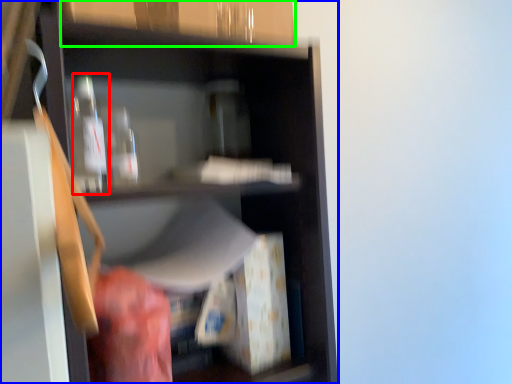
Question: Which object is the closest to the bottle (highlighted by a red box)? Choose among these: shelf (highlighted by a blue box) or cabinetry (highlighted by a green box).

Choices:
 (A) shelf
 (B) cabinetry

Answer: (B)